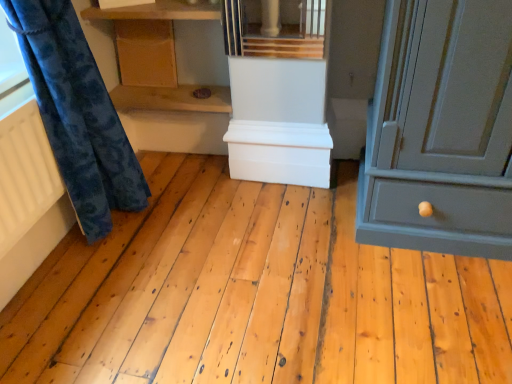
Question: Which direction should I rotate to face white matte chest at center, placed as the 1th cabinetry when sorted from bottom to top, — up or down?

Choices:
 (A) down
 (B) up

Answer: (B)

Question: Is wooden shelf at center, the second shelf positioned from the top, wider than white matte chest at center, placed as the 1th cabinetry when sorted from bottom to top?

Choices:
 (A) yes
 (B) no

Answer: (A)

Question: From a real-world perspective, is wooden shelf at center, which is counted as the 1th shelf, starting from the bottom, on top of white matte chest at center, arranged as the second cabinetry when viewed from the top?

Choices:
 (A) no
 (B) yes

Answer: (B)

Question: Is wooden shelf at center, which is counted as the 1th shelf, starting from the bottom, to the left of white matte chest at center, which ranks as the first cabinetry in right-to-left order, from the viewer's perspective?

Choices:
 (A) yes
 (B) no

Answer: (A)

Question: Is wooden shelf at center, which is counted as the 1th shelf, starting from the bottom, to the right of white matte chest at center, which is the 2th cabinetry in left-to-right order, from the viewer's perspective?

Choices:
 (A) no
 (B) yes

Answer: (A)

Question: Does wooden shelf at center, the second shelf positioned from the top, have a lesser height compared to white matte chest at center, which ranks as the first cabinetry in right-to-left order?

Choices:
 (A) no
 (B) yes

Answer: (B)

Question: From a real-world perspective, is wooden shelf at center, the second shelf positioned from the top, located beneath white matte chest at center, which is the 2th cabinetry in left-to-right order?

Choices:
 (A) yes
 (B) no

Answer: (B)

Question: Is wooden cabinet at upper center, the 2th cabinetry viewed from the right, facing away from white matte chest at center, placed as the 1th cabinetry when sorted from bottom to top?

Choices:
 (A) no
 (B) yes

Answer: (A)

Question: Considering the relative positions of wooden cabinet at upper center, placed as the first cabinetry when sorted from top to bottom, and white matte chest at center, arranged as the second cabinetry when viewed from the top, in the image provided, is wooden cabinet at upper center, placed as the first cabinetry when sorted from top to bottom, to the right of white matte chest at center, arranged as the second cabinetry when viewed from the top, from the viewer's perspective?

Choices:
 (A) yes
 (B) no

Answer: (B)

Question: From a real-world perspective, does wooden cabinet at upper center, placed as the first cabinetry when sorted from top to bottom, stand above white matte chest at center, which ranks as the first cabinetry in right-to-left order?

Choices:
 (A) no
 (B) yes

Answer: (B)

Question: Does wooden cabinet at upper center, arranged as the first cabinetry when viewed from the left, contain white matte chest at center, arranged as the second cabinetry when viewed from the top?

Choices:
 (A) yes
 (B) no

Answer: (B)

Question: From the image's perspective, is wooden cabinet at upper center, arranged as the first cabinetry when viewed from the left, located above white matte chest at center, which is the 2th cabinetry in left-to-right order?

Choices:
 (A) yes
 (B) no

Answer: (A)

Question: Considering the relative positions of wooden cabinet at upper center, placed as the first cabinetry when sorted from top to bottom, and white matte chest at center, which is the 2th cabinetry in left-to-right order, in the image provided, is wooden cabinet at upper center, placed as the first cabinetry when sorted from top to bottom, behind white matte chest at center, which is the 2th cabinetry in left-to-right order,?

Choices:
 (A) yes
 (B) no

Answer: (A)

Question: Is velvety blue curtain at left at the back of white matte radiator at left?

Choices:
 (A) no
 (B) yes

Answer: (A)